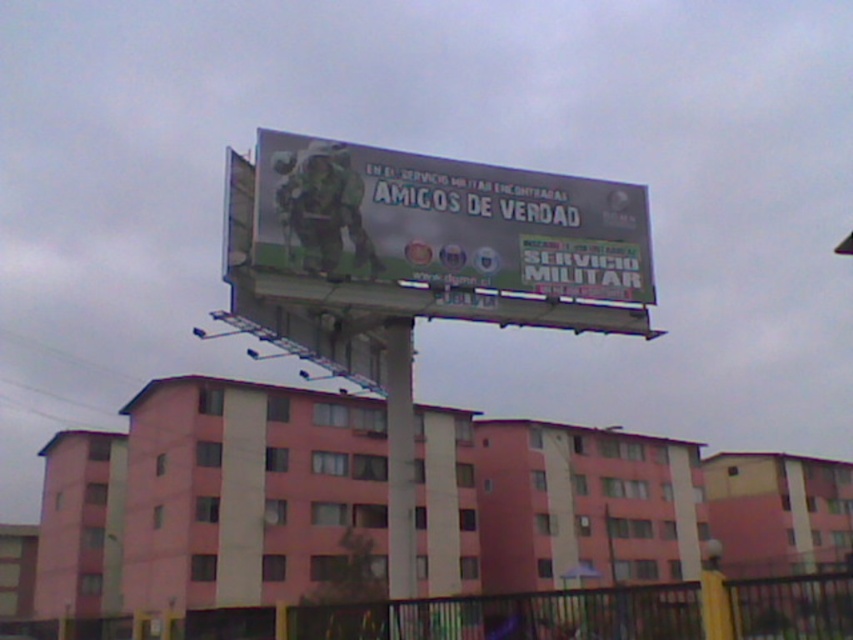
Question: Does metallic silver soldier at center appear under metallic pole at center?

Choices:
 (A) no
 (B) yes

Answer: (A)

Question: Among these objects, which one is nearest to the camera?

Choices:
 (A) metallic silver soldier at center
 (B) metallic pole at center

Answer: (B)

Question: Does metallic silver soldier at center come in front of metallic pole at center?

Choices:
 (A) no
 (B) yes

Answer: (A)

Question: Can you confirm if metallic silver soldier at center is bigger than metallic pole at center?

Choices:
 (A) yes
 (B) no

Answer: (B)

Question: Among these objects, which one is nearest to the camera?

Choices:
 (A) metallic silver soldier at center
 (B) metallic pole at center

Answer: (B)